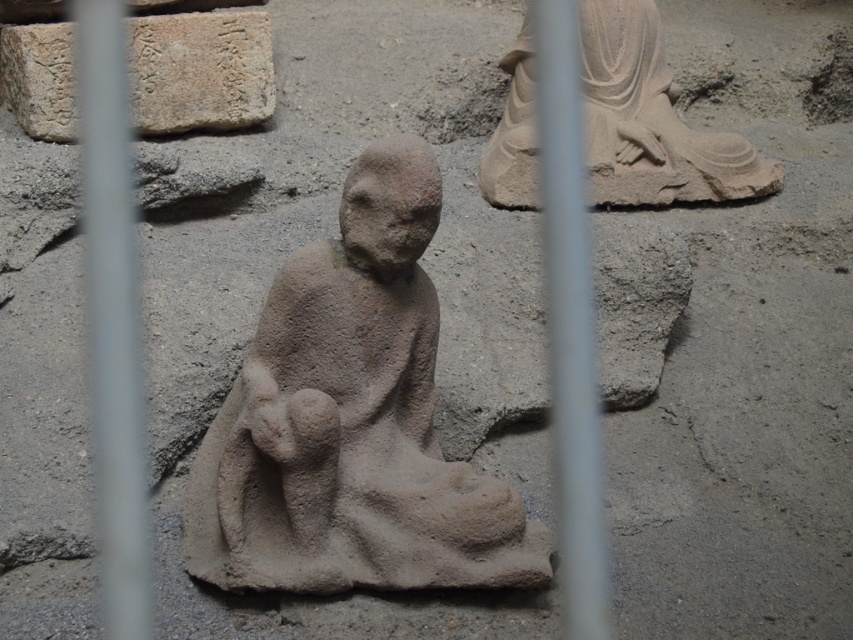
You are a photographer standing in front of the ancient stone sculptures. You notice two points marked in the scene. One is at point [631,96] and the other is at point [1,42]. Which point is closer to your camera?

Point [1,42] is closer to the camera because the Objects Description states that point [631,96] is further to the camera than point [1,42].

You are an art conservator examining the ancient stone sculptures. You need to clean the gray stone statue at center and the smooth stone statue at upper right. Which statue should you start with if you want to work from the closest to the furthest away first?

You should start with the gray stone statue at center because it is in front of the smooth stone statue at upper right, making it closer to you.

You are an archaeologist measuring distances between artifacts. You have a measuring tape that can only extend up to 30 inches. Can you measure the distance between the gray stone statue at center and the gray stone plaque at upper left without moving either object?

The gray stone statue at center is 33.44 inches from the gray stone plaque at upper left, which is longer than the measuring tape can extend. Therefore, you cannot measure the distance between the gray stone statue at center and the gray stone plaque at upper left without moving either object.